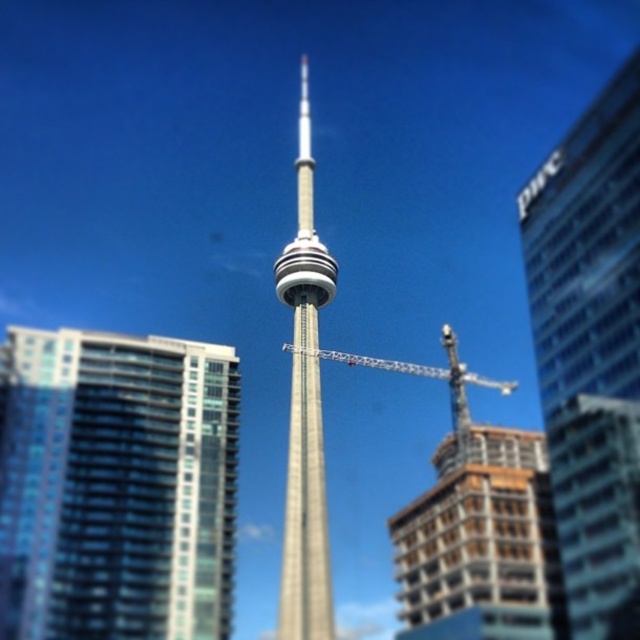
Which is more to the right, glassy reflective building at left or silver metallic cn tower at center?

From the viewer's perspective, silver metallic cn tower at center appears more on the right side.

Does glassy reflective building at left have a lesser width compared to silver metallic cn tower at center?

Incorrect, glassy reflective building at left's width is not less than silver metallic cn tower at center's.

Between point (36, 396) and point (288, 598), which one is positioned behind?

The point (36, 396) is more distant.

What are the coordinates of `glassy reflective building at left` in the screenshot? It's located at (116, 484).

Which is below, glassy reflective building at left or wooden frame building at lower right?

Positioned lower is wooden frame building at lower right.

Is glassy reflective building at left behind wooden frame building at lower right?

No, glassy reflective building at left is closer to the viewer.

Does point (220, 387) lie behind point (499, 600)?

Yes, point (220, 387) is farther from viewer.

The width and height of the screenshot is (640, 640). I want to click on glassy reflective building at left, so click(116, 484).

Who is higher up, glassy reflective building at right or metallic gray crane at center?

Positioned higher is glassy reflective building at right.

Is point (568, 552) closer to viewer compared to point (296, 348)?

Yes, it is in front of point (296, 348).

This screenshot has width=640, height=640. In order to click on glassy reflective building at right in this screenshot , I will do `click(589, 349)`.

I want to click on glassy reflective building at right, so click(589, 349).